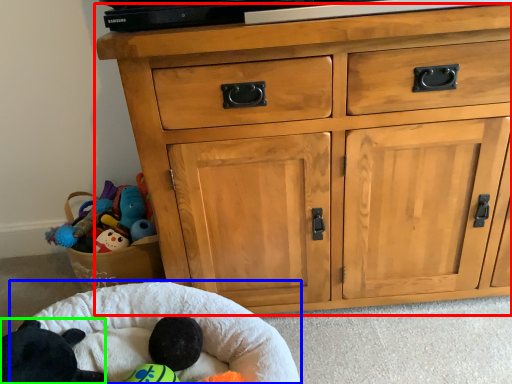
Question: Considering the real-world distances, which object is closest to chest of drawers (highlighted by a red box)? infant bed (highlighted by a blue box) or animal (highlighted by a green box).

Choices:
 (A) infant bed
 (B) animal

Answer: (A)